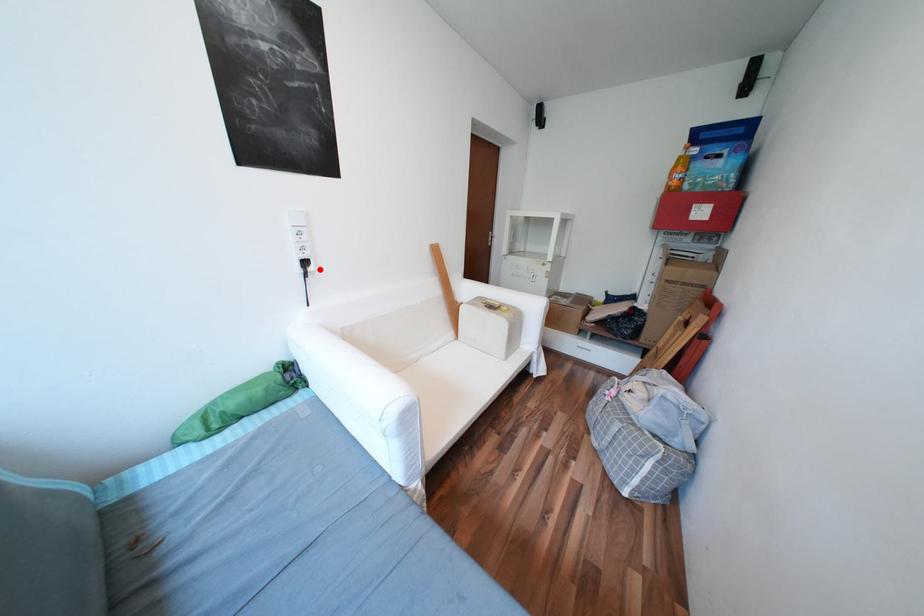
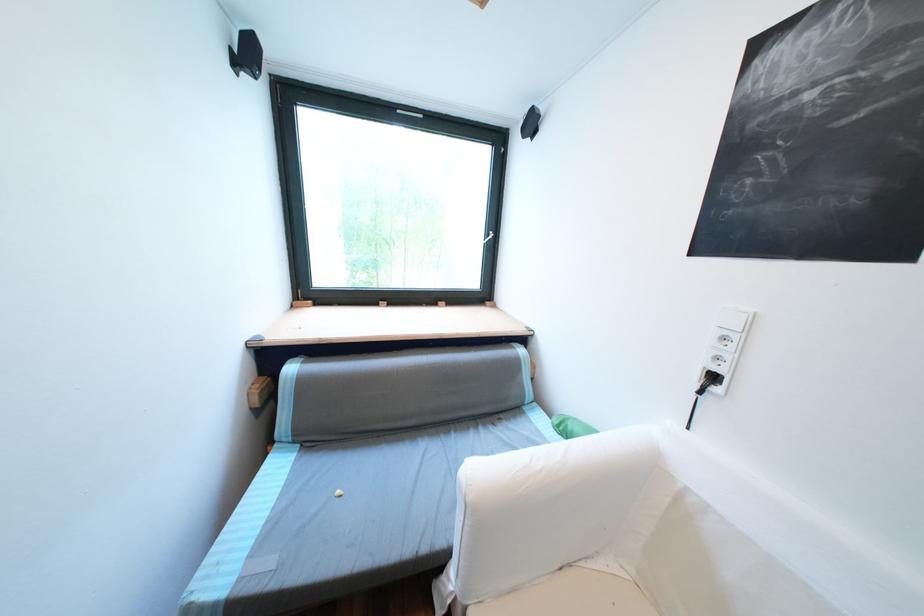
Where in the second image is the point corresponding to the highlighted location from the first image?

(725, 390)